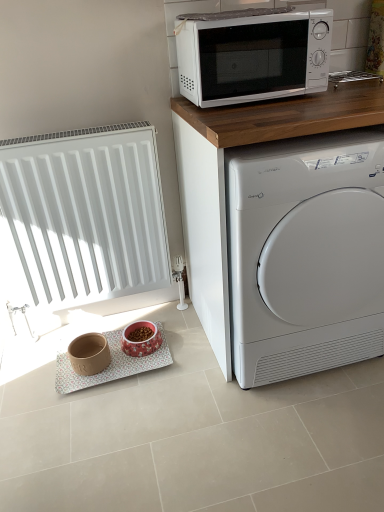
The width and height of the screenshot is (384, 512). In order to click on free space in front of pink glossy bowl at lower center, the first appliance viewed from the right in this screenshot , I will do `click(135, 372)`.